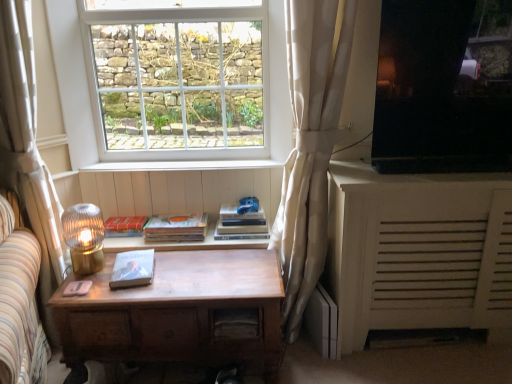
Image resolution: width=512 pixels, height=384 pixels. Identify the location of empty space that is to the right of matte white paperback book at center, the third paperback book when ordered from back to front. (174, 271).